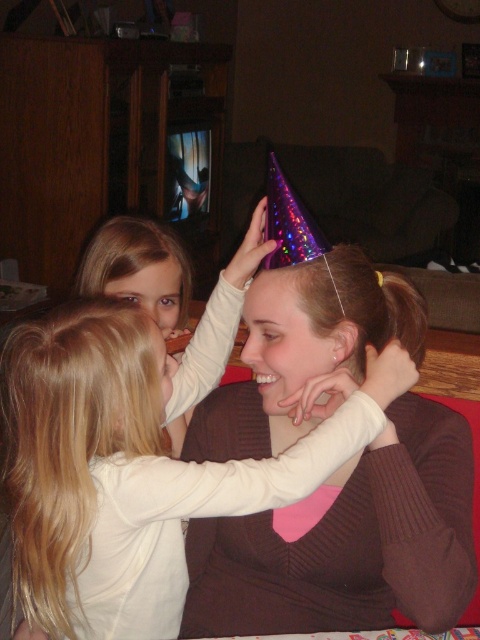
You are standing at the point marked as point (100, 442) and want to take a photo of the scene. The camera you have can only focus on objects within 30 inches. Will the camera be able to focus on the scene?

The distance between point (100, 442) and the camera is 34.13 inches, which is beyond the camera focus range of 30 inches. Therefore, the camera will not be able to focus on the scene.

You are standing at the entrance of the living room and want to greet the person wearing the matte white shirt at center. In which direction should you walk to reach them?

Since the matte white shirt at center is located at point 0.731 on the x axis and 0.281 on the y axis, you should walk towards the center of the room to reach them.